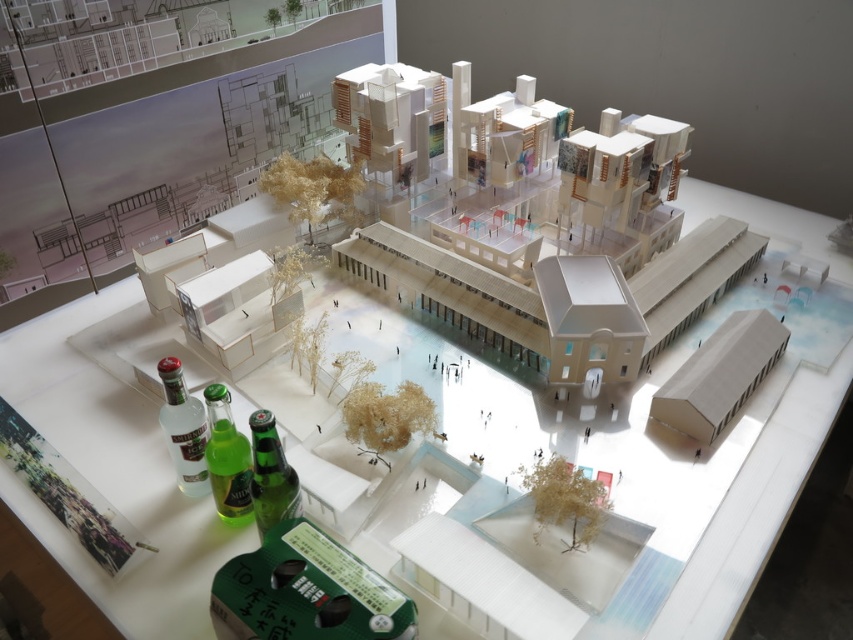
You are an architect examining the urban model. You need to place a new decorative element between the green matte beer can at center and the clear glass bottle at lower left. Which object should the new element be placed closer to?

The new decorative element should be placed closer to the clear glass bottle at lower left because the green matte beer can at center is in front of it, meaning the bottle is further back.

You are an architect examining the urban model. You need to place a new small sculpture exactly between the green matte beer can at center and the clear glass bottle at lower left. Which object will the sculpture be closer to?

Result: The sculpture will be closer to the green matte beer can at center because it is not as tall as the clear glass bottle at lower left, so the midpoint between them would be nearer to the shorter object.

You are examining the architectural model and notice a clear glass bottle at lower left. Where exactly is it positioned in relation to the model?

The clear glass bottle at lower left is located at coordinates point (x=183, y=429) within the model.